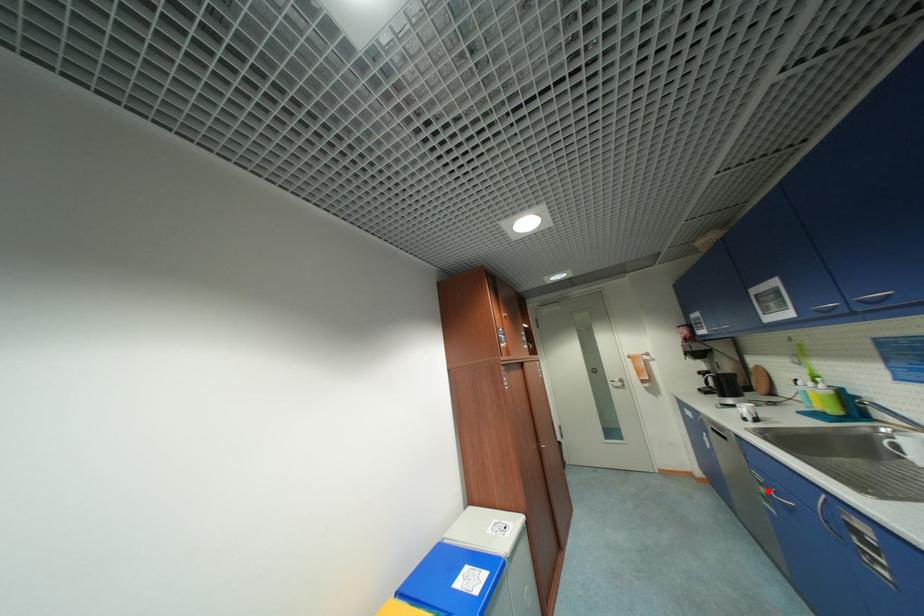
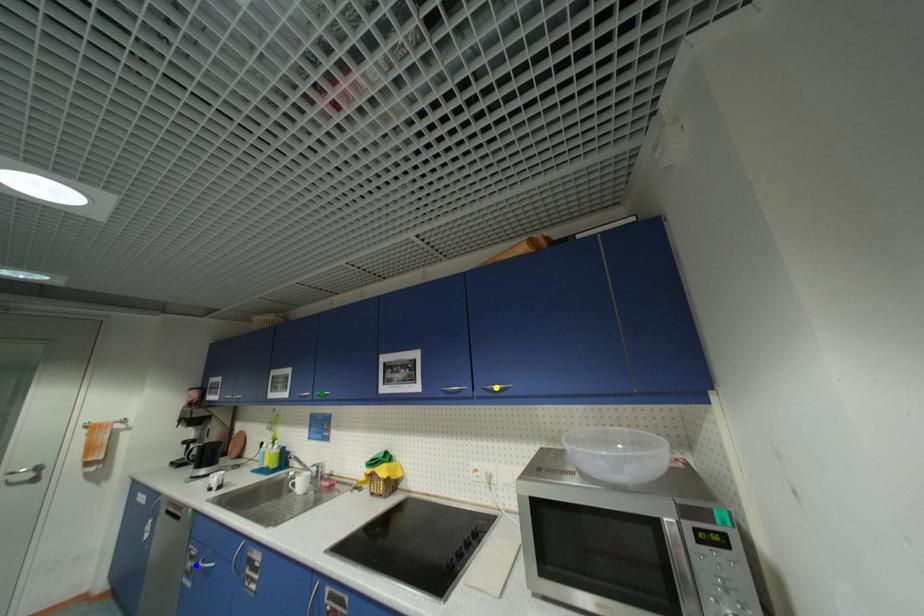
Question: I am providing you with two images of the same scene from different viewpoints. A red point is marked on the first image. You are given multiple points on the second image. Which point in image 2 represents the same 3d spot as the red point in image 1?

Choices:
 (A) yellow point
 (B) green point
 (C) blue point

Answer: (C)